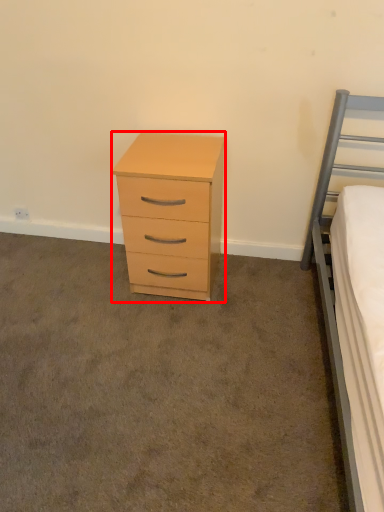
Question: From the image's perspective, where is chest of drawers (annotated by the red box) located relative to plain?

Choices:
 (A) above
 (B) below

Answer: (A)